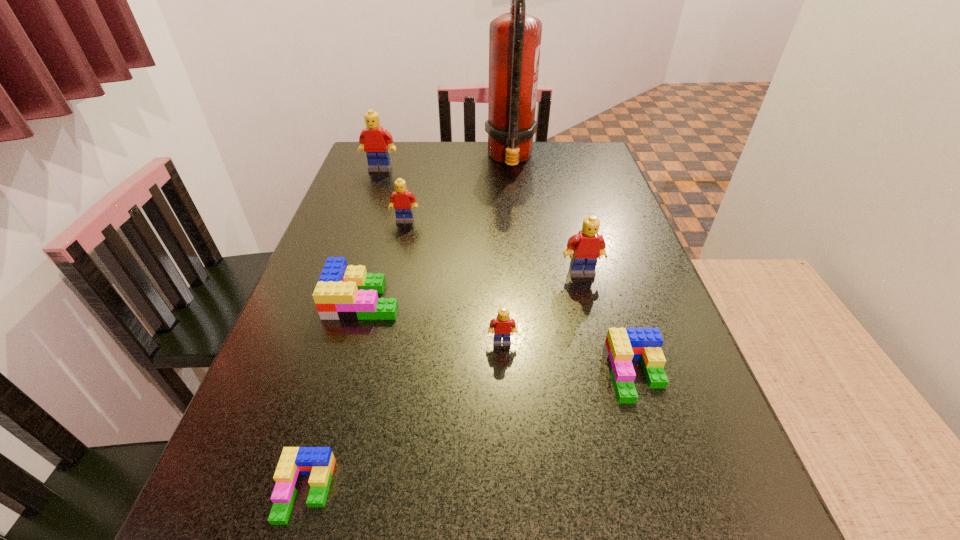
In the image, there is a desktop. Identify the location of free region at the left edge. Image resolution: width=960 pixels, height=540 pixels. click(376, 242).

The height and width of the screenshot is (540, 960). In order to click on free space at the right edge of the desktop in this screenshot , I will do `click(588, 192)`.

This screenshot has width=960, height=540. In the image, there is a desktop. In order to click on vacant region at the far left corner in this screenshot , I will do `click(391, 173)`.

You are a GUI agent. You are given a task and a screenshot of the screen. Output one action in this format:
    pyautogui.click(x=<x>, y=<y>)
    Task: Click on the free space at the far right corner
    
    Given the screenshot: What is the action you would take?
    pyautogui.click(x=572, y=142)

The width and height of the screenshot is (960, 540). In order to click on empty space that is in between the biggest yellow Lego and the nearest Lego in this screenshot , I will do `click(343, 330)`.

Image resolution: width=960 pixels, height=540 pixels. Identify the location of free spot between the sixth nearest Lego and the nearest object. (355, 356).

Locate an element on the screen. free space between the fourth nearest Lego and the smallest green Lego is located at coordinates (334, 395).

I want to click on vacant region between the red fire extinguisher and the nearest yellow Lego, so click(x=506, y=250).

Locate an element on the screen. The width and height of the screenshot is (960, 540). empty space between the farthest green Lego and the farthest Lego is located at coordinates (372, 234).

Find the location of `free space that is in between the smallest green Lego and the second tallest object`. free space that is in between the smallest green Lego and the second tallest object is located at coordinates (343, 330).